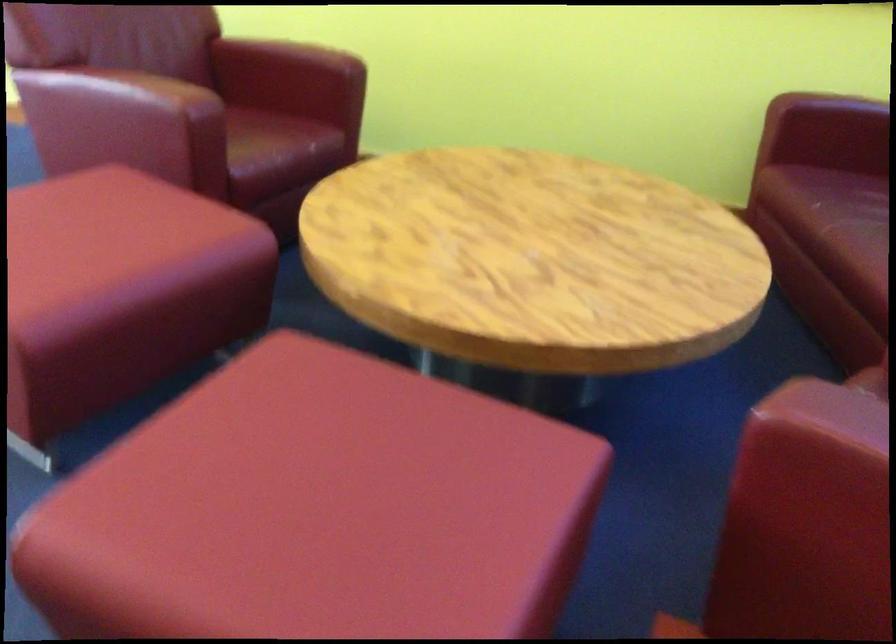
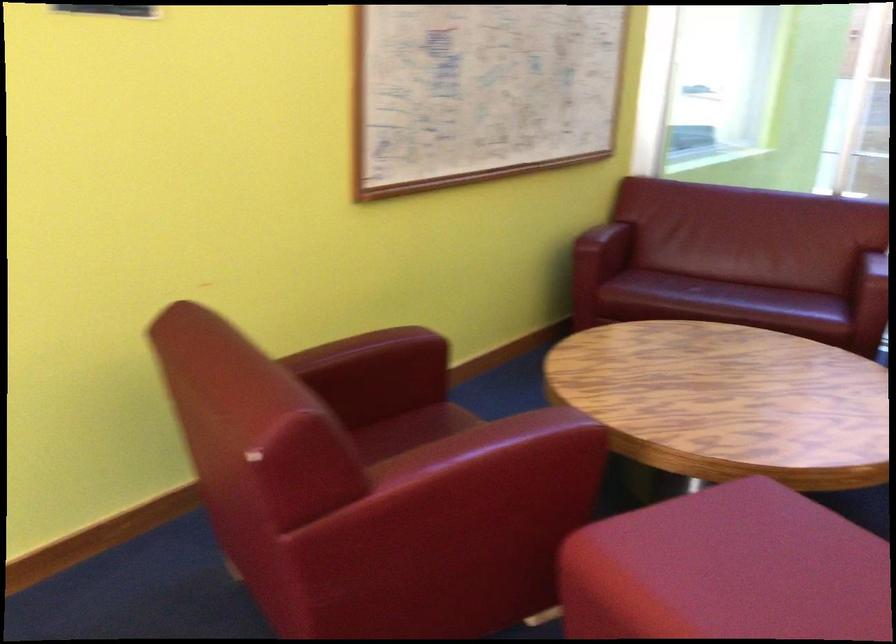
In the second image, find the point that corresponds to (x=254, y=116) in the first image.

(410, 428)